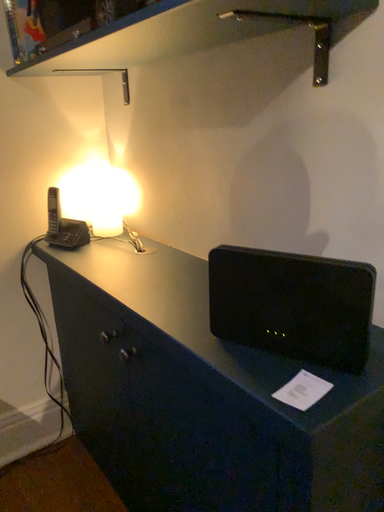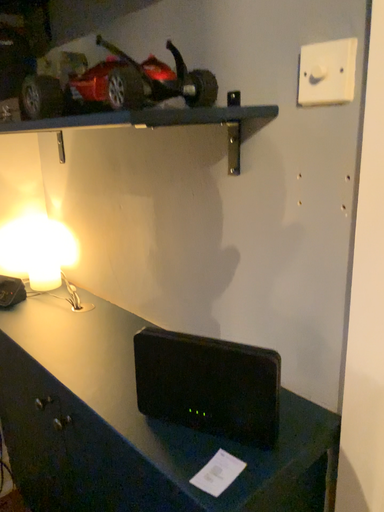
Question: Which way did the camera rotate in the video?

Choices:
 (A) rotated right
 (B) rotated left

Answer: (A)